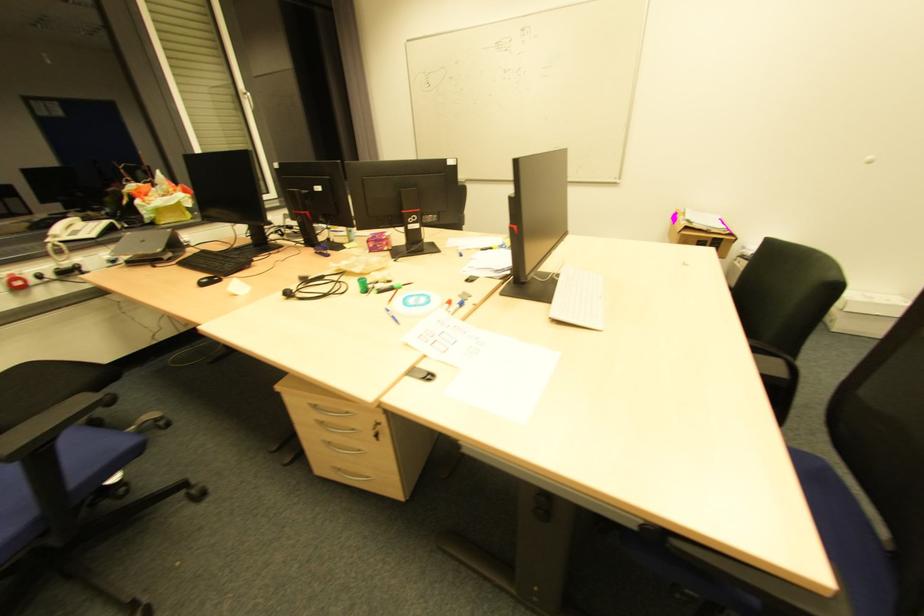
Identify the location of red power button. This screenshot has height=616, width=924. (16, 282).